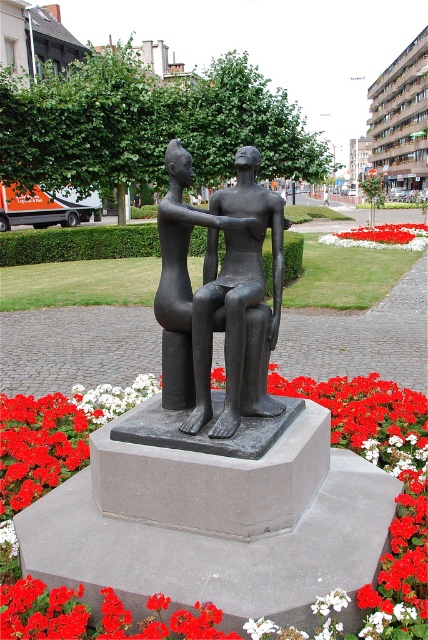
Which is more to the right, red matte flower at center or white fabric flower at lower center?

From the viewer's perspective, white fabric flower at lower center appears more on the right side.

The image size is (428, 640). What do you see at coordinates (51, 488) in the screenshot?
I see `red matte flower at center` at bounding box center [51, 488].

Locate an element on the screen. red matte flower at center is located at coordinates (51, 488).

Is point (149, 380) in front of point (237, 163)?

No, (149, 380) is behind (237, 163).

Does red matte flower at center have a smaller size compared to bronze statue at center?

Incorrect, red matte flower at center is not smaller in size than bronze statue at center.

Describe the element at coordinates (51, 488) in the screenshot. I see `red matte flower at center` at that location.

Identify the location of red matte flower at center. (51, 488).

Is bronze statue at center further to the viewer compared to white fabric flower at lower center?

That is False.

Consider the image. Between bronze statue at center and white fabric flower at lower center, which one has more height?

white fabric flower at lower center is taller.

Who is more forward, (247, 160) or (376, 241)?

Point (247, 160)

You are a GUI agent. You are given a task and a screenshot of the screen. Output one action in this format:
    pyautogui.click(x=<x>, y=<y>)
    Task: Click on the bronze statue at center
    This screenshot has width=428, height=640.
    Given the screenshot: What is the action you would take?
    pyautogui.click(x=234, y=289)